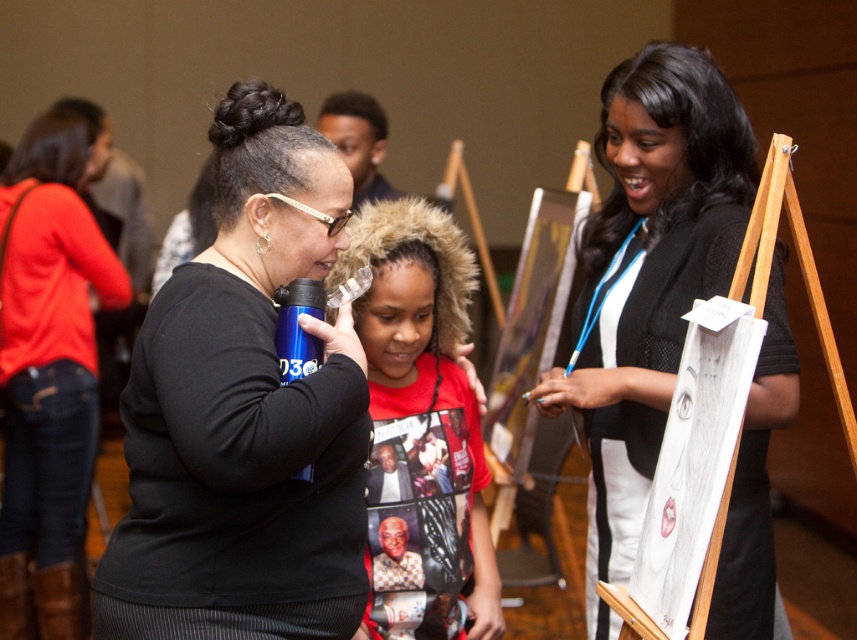
You are organizing a photo shoot and need to position two models wearing the red cotton hoodie at center and the matte black shirt at center. The camera requires a minimum distance of 1.5 meters between subjects for optimal focus. Can you place them according to the camera requirements?

The red cotton hoodie at center is 1.81 meters away from the matte black shirt at center, which exceeds the camera requirement of 1.5 meters. Therefore, the current distance between the red cotton hoodie at center and the matte black shirt at center is sufficient for optimal focus.

You are organizing a community event and need to place a sign next to the blue matte water bottle at center. According to the coordinates provided, where should you position the sign relative to the water bottle?

The blue matte water bottle at center is located at point (244, 412), so you should position the sign near those coordinates to place it next to the water bottle.